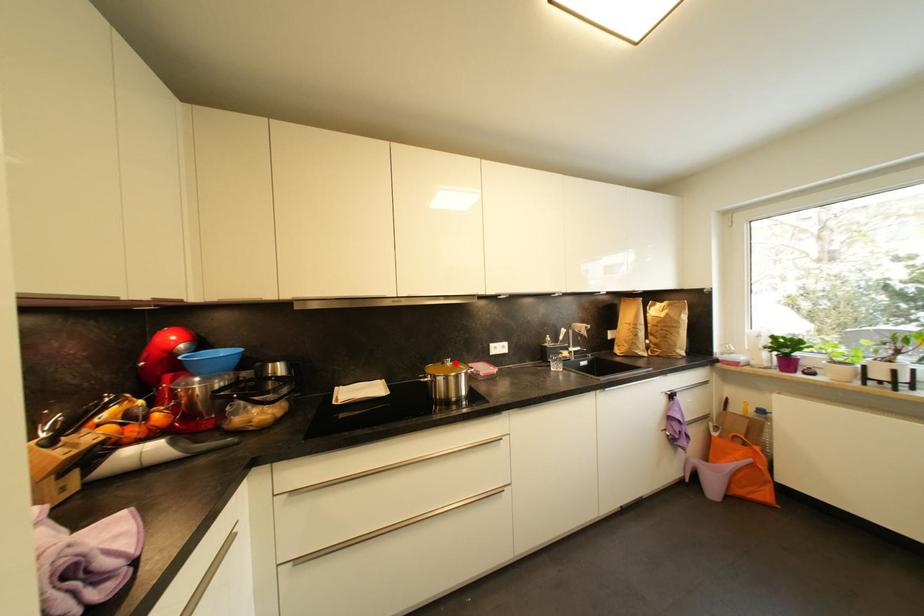
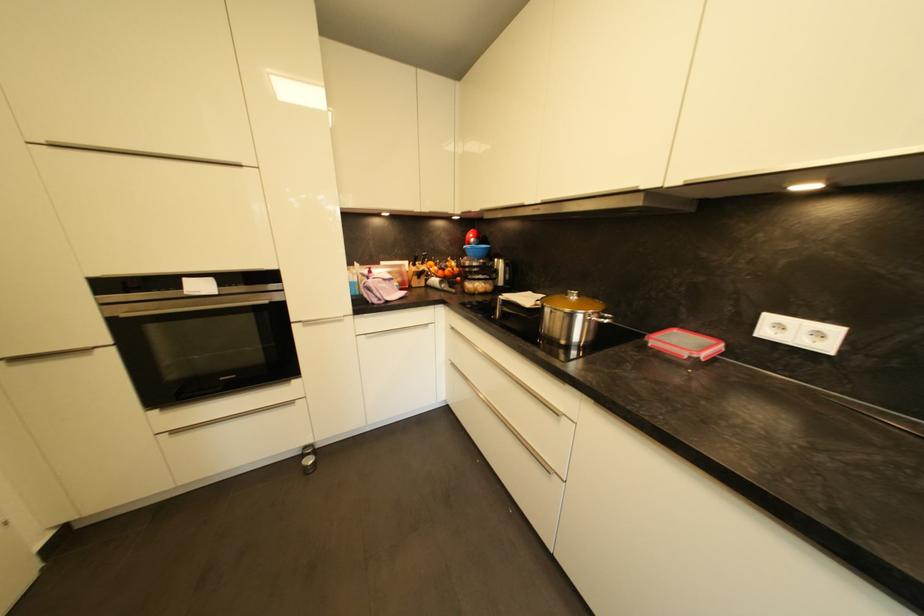
In the second image, find the point that corresponds to the highlighted location in the first image.

(584, 298)